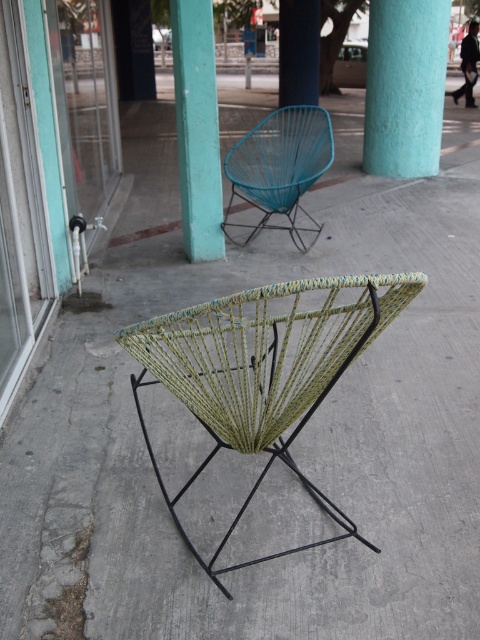
Who is taller, green woven chair at center or teal woven chair at upper center?

Standing taller between the two is teal woven chair at upper center.

Can you confirm if green woven chair at center is taller than teal woven chair at upper center?

No.

Identify the location of green woven chair at center. (262, 372).

In order to click on green woven chair at center in this screenshot , I will do `click(262, 372)`.

Can you confirm if teal matte/rough pillar at upper center is positioned to the left of teal woven chair at upper center?

Correct, you'll find teal matte/rough pillar at upper center to the left of teal woven chair at upper center.

Which is behind, point (181, 148) or point (299, 147)?

Positioned behind is point (299, 147).

Locate an element on the screen. teal matte/rough pillar at upper center is located at coordinates (196, 129).

Identify the location of teal matte/rough pillar at upper center. coord(196,129).

Between teal matte/rough pillar at center and teal woven chair at upper center, which one appears on the left side from the viewer's perspective?

teal woven chair at upper center

This screenshot has width=480, height=640. What do you see at coordinates (405, 86) in the screenshot?
I see `teal matte/rough pillar at center` at bounding box center [405, 86].

The height and width of the screenshot is (640, 480). Find the location of `teal matte/rough pillar at center`. teal matte/rough pillar at center is located at coordinates tap(405, 86).